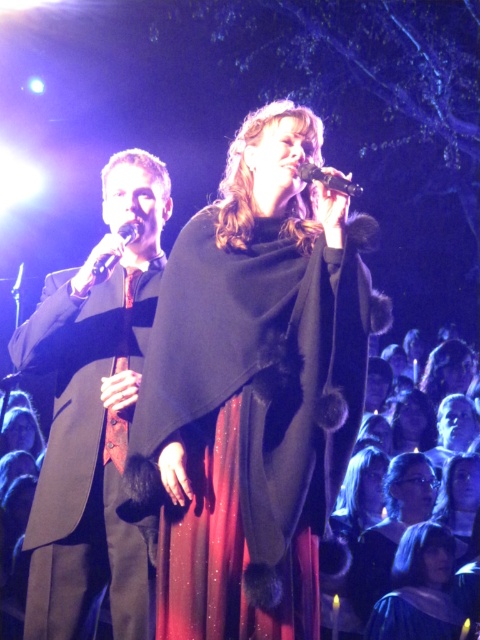
Is matte black suit at left bigger than shiny metallic microphone at center?

Yes, matte black suit at left is bigger than shiny metallic microphone at center.

Where is `matte black suit at left`? matte black suit at left is located at coordinates (95, 417).

Find the location of a particular element. matte black suit at left is located at coordinates (95, 417).

Consider the image. Which is more to the left, shiny black dress at center or shiny metallic microphone at center?

shiny metallic microphone at center

Is shiny black dress at center shorter than shiny metallic microphone at center?

No, shiny black dress at center is not shorter than shiny metallic microphone at center.

Find the location of a particular element. The height and width of the screenshot is (640, 480). shiny black dress at center is located at coordinates (458, 499).

Image resolution: width=480 pixels, height=640 pixels. I want to click on shiny black dress at center, so click(x=458, y=499).

Is velvet black cape at center below black metallic microphone at upper center?

Correct, velvet black cape at center is located below black metallic microphone at upper center.

Can you confirm if velvet black cape at center is taller than black metallic microphone at upper center?

Indeed, velvet black cape at center has a greater height compared to black metallic microphone at upper center.

This screenshot has width=480, height=640. What do you see at coordinates (253, 388) in the screenshot?
I see `velvet black cape at center` at bounding box center [253, 388].

The height and width of the screenshot is (640, 480). I want to click on velvet black cape at center, so click(253, 388).